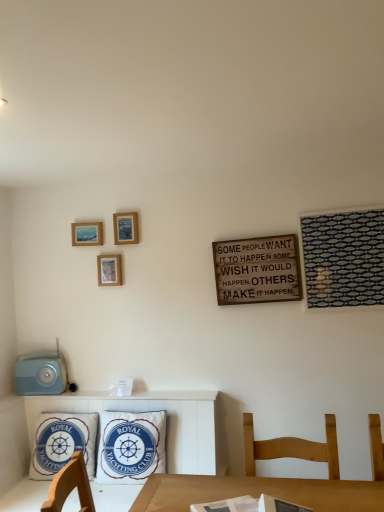
Question: Would you say blue cotton pillow at lower left, which is the second pillow from right to left, is outside wooden picture frame at upper left, which is the third picture frame in right-to-left order?

Choices:
 (A) yes
 (B) no

Answer: (A)

Question: Could you tell me if blue cotton pillow at lower left, acting as the first pillow starting from the left, is turned towards wooden picture frame at upper left, which is counted as the second picture frame, starting from the top?

Choices:
 (A) yes
 (B) no

Answer: (B)

Question: From a real-world perspective, is blue cotton pillow at lower left, acting as the first pillow starting from the left, positioned under wooden picture frame at upper left, which is counted as the second picture frame, starting from the top, based on gravity?

Choices:
 (A) no
 (B) yes

Answer: (B)

Question: Is blue cotton pillow at lower left, which is the second pillow from right to left, touching wooden picture frame at upper left, arranged as the 2th picture frame when ordered from the bottom?

Choices:
 (A) yes
 (B) no

Answer: (B)

Question: Is wooden picture frame at upper left, which is counted as the second picture frame, starting from the top, at the back of blue cotton pillow at lower left, acting as the first pillow starting from the left?

Choices:
 (A) no
 (B) yes

Answer: (A)

Question: In terms of size, does wooden picture frame at center-left, acting as the first picture frame starting from the bottom, appear bigger or smaller than blue cotton pillow at lower left, acting as the first pillow starting from the left?

Choices:
 (A) small
 (B) big

Answer: (A)

Question: Based on their positions, is wooden picture frame at center-left, the 3th picture frame when ordered from top to bottom, located to the left or right of blue cotton pillow at lower left, acting as the first pillow starting from the left?

Choices:
 (A) right
 (B) left

Answer: (A)

Question: In terms of height, does wooden picture frame at center-left, the 3th picture frame when ordered from top to bottom, look taller or shorter compared to blue cotton pillow at lower left, which is the second pillow from right to left?

Choices:
 (A) tall
 (B) short

Answer: (B)

Question: From a real-world perspective, is wooden picture frame at center-left, acting as the first picture frame starting from the bottom, positioned above or below blue cotton pillow at lower left, acting as the first pillow starting from the left?

Choices:
 (A) above
 (B) below

Answer: (A)

Question: From a real-world perspective, is white fabric pillow at center, which ranks as the 2th pillow in left-to-right order, above or below wooden picture frame at center-left, acting as the first picture frame starting from the bottom?

Choices:
 (A) below
 (B) above

Answer: (A)

Question: Is white fabric pillow at center, which ranks as the 2th pillow in left-to-right order, taller or shorter than wooden picture frame at center-left, which is counted as the second picture frame, starting from the left?

Choices:
 (A) tall
 (B) short

Answer: (A)

Question: Relative to wooden picture frame at center-left, the 3th picture frame when ordered from top to bottom, is white fabric pillow at center, which ranks as the 2th pillow in left-to-right order, in front or behind?

Choices:
 (A) front
 (B) behind

Answer: (A)

Question: Considering the positions of white fabric pillow at center, which ranks as the 2th pillow in left-to-right order, and wooden picture frame at center-left, marked as the 2th picture frame in a right-to-left arrangement, in the image, is white fabric pillow at center, which ranks as the 2th pillow in left-to-right order, bigger or smaller than wooden picture frame at center-left, marked as the 2th picture frame in a right-to-left arrangement,?

Choices:
 (A) small
 (B) big

Answer: (B)

Question: Visually, is wooden chair at lower right positioned to the left or to the right of wooden picture frame at upper left, which is counted as the second picture frame, starting from the top?

Choices:
 (A) left
 (B) right

Answer: (B)

Question: In the image, is wooden chair at lower right positioned in front of or behind wooden picture frame at upper left, which is counted as the second picture frame, starting from the top?

Choices:
 (A) behind
 (B) front

Answer: (B)